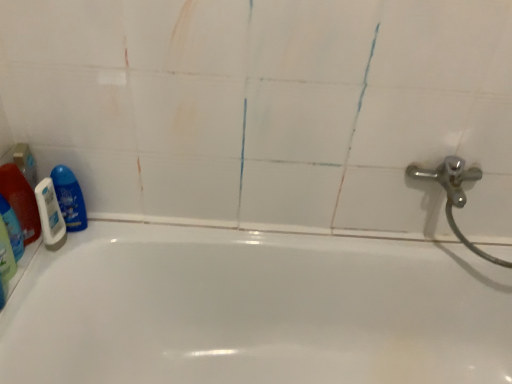
Question: Would you say white matte shaving cream at left is inside or outside blue glossy bottle at left, which ranks as the third cleaning product in left-to-right order?

Choices:
 (A) outside
 (B) inside

Answer: (A)

Question: Is white matte shaving cream at left bigger or smaller than blue glossy bottle at left, which is the first cleaning product from right to left?

Choices:
 (A) big
 (B) small

Answer: (B)

Question: Considering the real-world distances, which object is farthest from the translucent plastic bottle at left, the 1th cleaning product from the left?

Choices:
 (A) white glossy bathtub at center
 (B) white matte shaving cream at left
 (C) blue glossy bottle at left, which ranks as the third cleaning product in left-to-right order
 (D) translucent plastic bottle at left, which appears as the 2th cleaning product when viewed from the right

Answer: (A)

Question: Estimate the real-world distances between objects in this image. Which object is closer to the translucent plastic bottle at left, the 1th cleaning product from the left?

Choices:
 (A) translucent plastic bottle at left, positioned as the second cleaning product in left-to-right order
 (B) white glossy bathtub at center
 (C) white matte shaving cream at left
 (D) blue glossy bottle at left, which is the first cleaning product from right to left

Answer: (A)